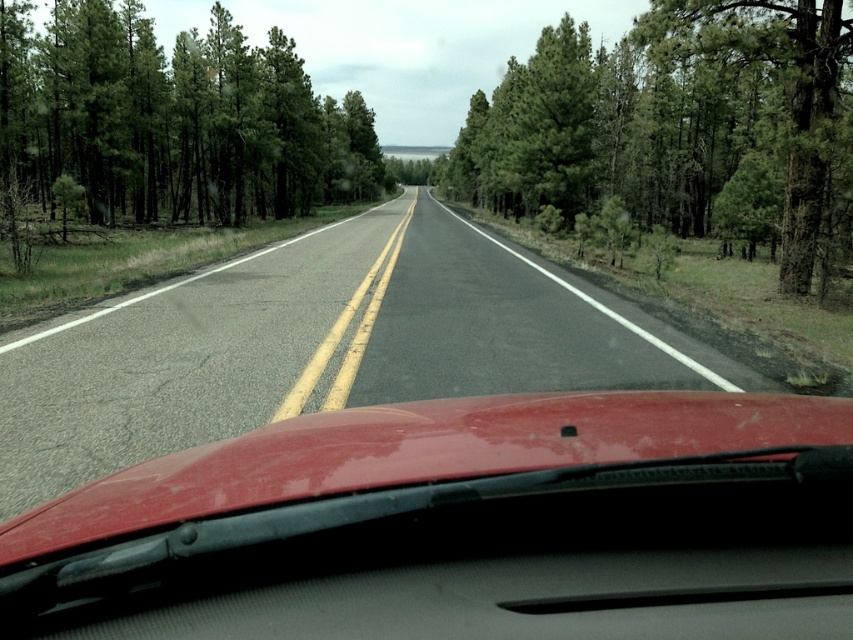
Question: Is asphalt road at center below green matte tree at left?

Choices:
 (A) no
 (B) yes

Answer: (B)

Question: Which of the following is the closest to the observer?

Choices:
 (A) tap(341, 179)
 (B) tap(761, 198)
 (C) tap(537, 547)
 (D) tap(395, 218)

Answer: (C)

Question: Among these objects, which one is nearest to the camera?

Choices:
 (A) glossy red car at center
 (B) green textured tree at center

Answer: (A)

Question: Observing the image, what is the correct spatial positioning of glossy red car at center in reference to green matte tree at left?

Choices:
 (A) left
 (B) right

Answer: (B)

Question: Which is farther from the asphalt road at center?

Choices:
 (A) glossy red car at center
 (B) green textured tree at center
 (C) green matte tree at left

Answer: (C)

Question: Observing the image, what is the correct spatial positioning of glossy red car at center in reference to green matte tree at left?

Choices:
 (A) left
 (B) right

Answer: (B)